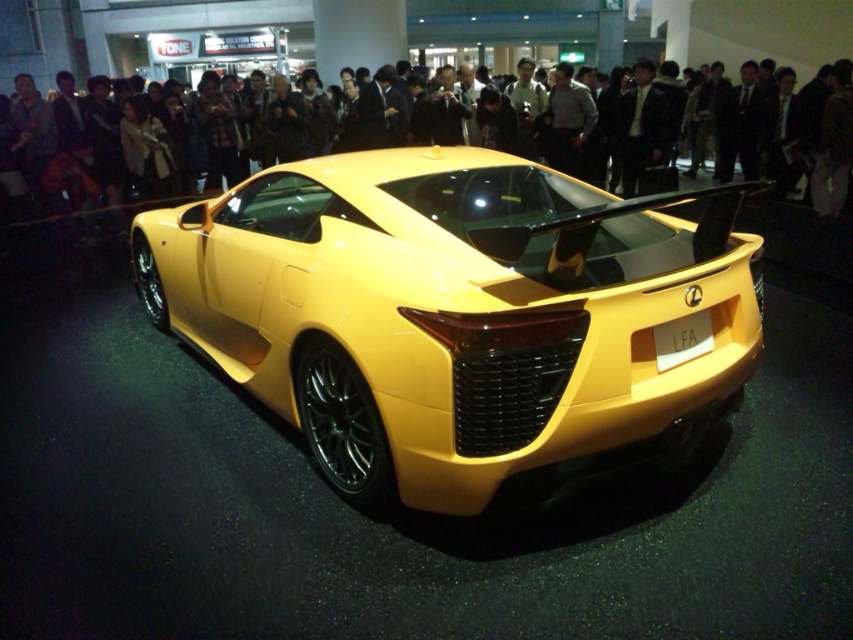
Can you confirm if yellow matte/solid car at center is positioned to the right of matte black crowd at upper center?

In fact, yellow matte/solid car at center is to the left of matte black crowd at upper center.

Can you confirm if yellow matte/solid car at center is thinner than matte black crowd at upper center?

Indeed, yellow matte/solid car at center has a lesser width compared to matte black crowd at upper center.

Which is in front, point (393, 310) or point (849, 205)?

Point (393, 310) is in front.

At what (x,y) coordinates should I click in order to perform the action: click on yellow matte/solid car at center. Please return your answer as a coordinate pair (x, y). Looking at the image, I should click on (461, 317).